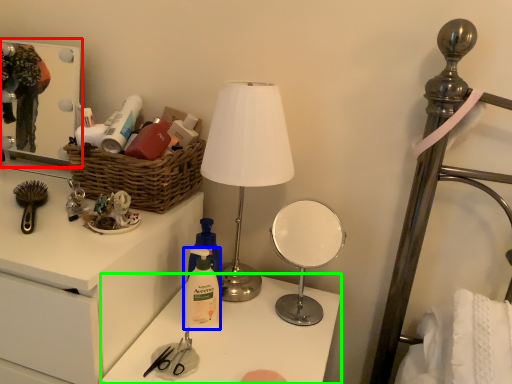
Question: Which object is the farthest from medicine cabinet (highlighted by a red box)? Choose among these: toiletry (highlighted by a blue box) or table (highlighted by a green box).

Choices:
 (A) toiletry
 (B) table

Answer: (A)